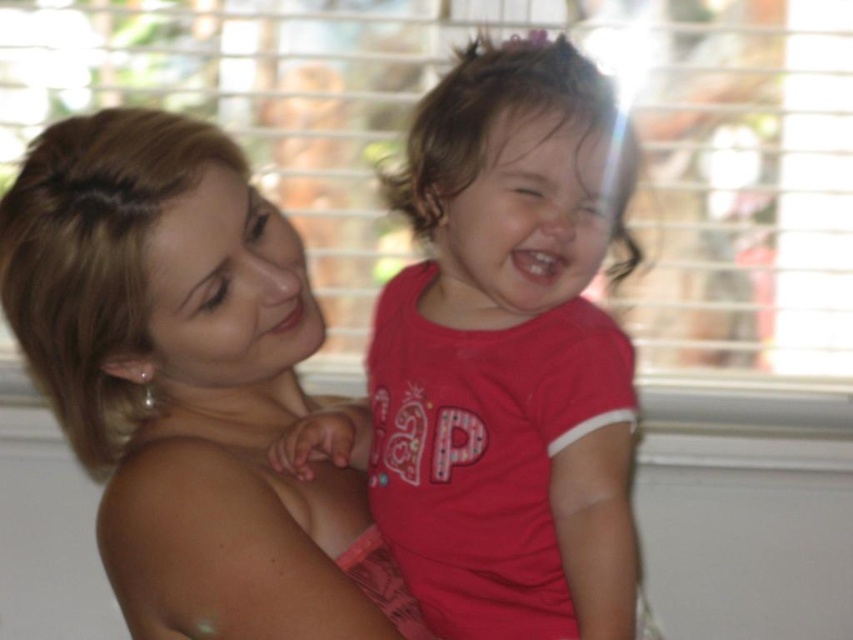
This screenshot has height=640, width=853. In order to click on pink matte shirt at center in this screenshot , I will do `click(502, 358)`.

Image resolution: width=853 pixels, height=640 pixels. Describe the element at coordinates (502, 358) in the screenshot. I see `pink matte shirt at center` at that location.

Image resolution: width=853 pixels, height=640 pixels. What are the coordinates of `pink matte shirt at center` in the screenshot? It's located at (502, 358).